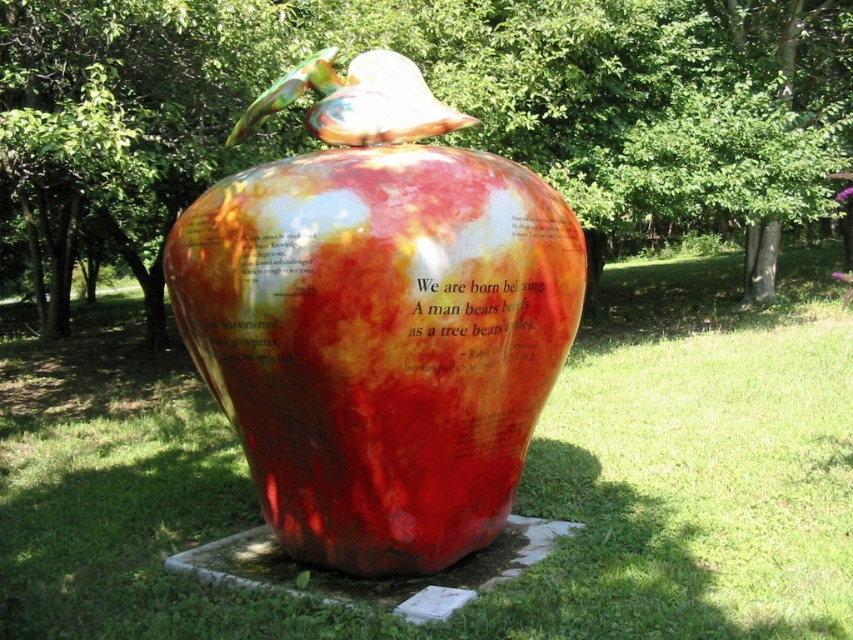
You are planning to place a small garden ornament that requires a base area of 1 square meter. Given the green grass at center and the glossy ceramic apple at center, which surface can accommodate the ornament based on their widths?

The glossy ceramic apple at center can accommodate the ornament since its width is greater than the green grass at center, providing enough space for the 1 square meter base area.

You are standing in a park and see the sculpture of the apple. You want to take a photo of the sculpture from a distance that is exactly 4.43 meters away. Can you confirm if you can achieve this by standing at the point marked as point (711,490)?

Yes, you can achieve the desired distance by standing at point (711,490) because the distance from that point to the camera is exactly 4.43 meters.